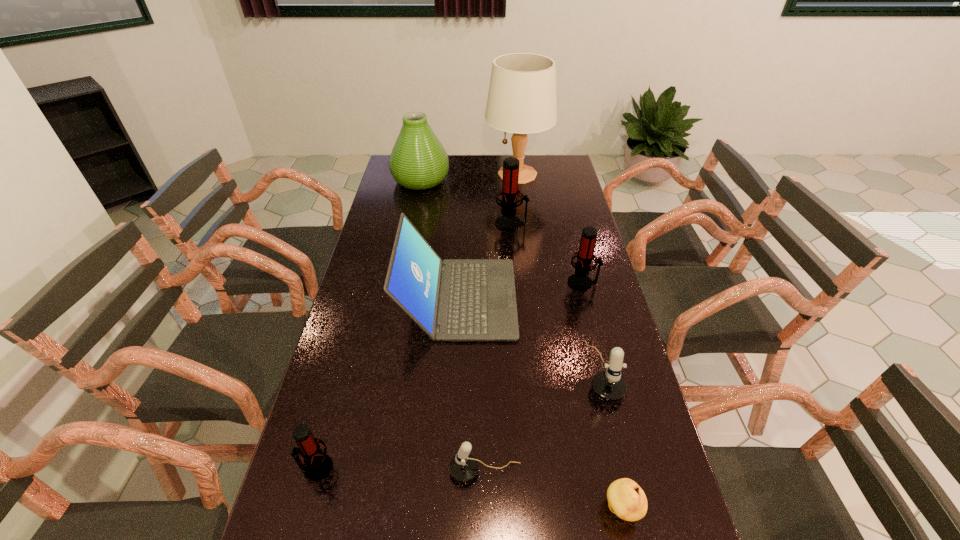
Image resolution: width=960 pixels, height=540 pixels. I want to click on vacant space located on the screen of the gray laptop computer, so pyautogui.click(x=572, y=299).

Where is `free space located on the left of the farther white microphone`? free space located on the left of the farther white microphone is located at coordinates click(x=527, y=372).

Identify the location of vacant space located 0.200m on the right of the leftmost microphone. (420, 468).

You are a GUI agent. You are given a task and a screenshot of the screen. Output one action in this format:
    pyautogui.click(x=<x>, y=<y>)
    Task: Click on the vacant space situated on the front of the shortest microphone
    Image resolution: width=960 pixels, height=540 pixels.
    Given the screenshot: What is the action you would take?
    pyautogui.click(x=486, y=531)

I want to click on free location located 0.160m on the left of the nearest object, so click(528, 509).

Where is `table lamp that is at the far edge`? The height and width of the screenshot is (540, 960). table lamp that is at the far edge is located at coordinates (522, 99).

Locate an element on the screen. The image size is (960, 540). vase that is positioned at the far edge is located at coordinates (418, 161).

Find the location of a particular element. vase located at the left edge is located at coordinates (418, 161).

Where is `microphone that is at the left edge`? The width and height of the screenshot is (960, 540). microphone that is at the left edge is located at coordinates (317, 465).

Where is `table lamp situated at the right edge`? table lamp situated at the right edge is located at coordinates (522, 99).